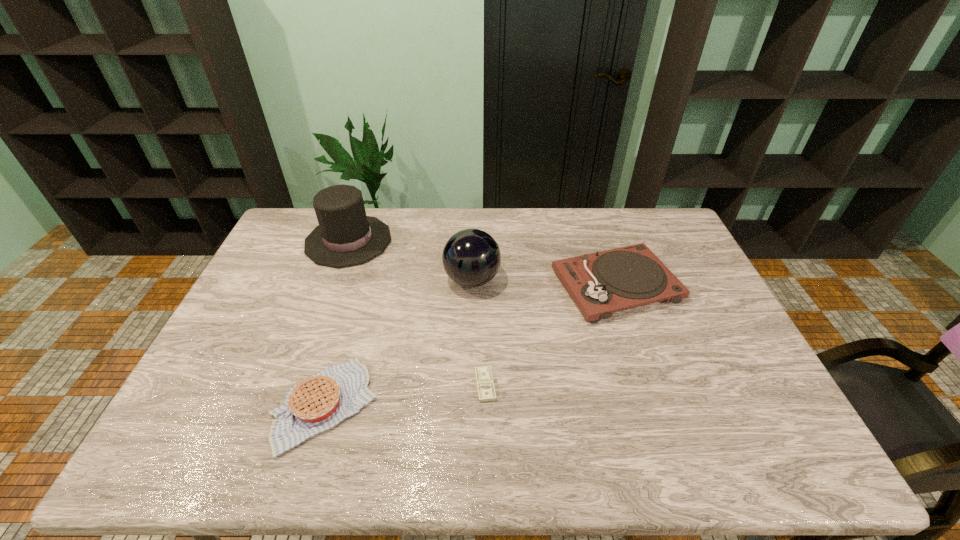
Image resolution: width=960 pixels, height=540 pixels. What are the coordinates of `vacant point that satisfies the following two spatial constraints: 1. on the back side of the phonograph_record; 2. on the front of the dress hat with the decoration` in the screenshot? It's located at (601, 241).

The height and width of the screenshot is (540, 960). In order to click on free spot that satisfies the following two spatial constraints: 1. on the side of the rightmost object with the finger holes; 2. on the left side of the bowling ball in this screenshot , I will do `click(472, 285)`.

What are the coordinates of `free space that satisfies the following two spatial constraints: 1. on the back side of the shortest object; 2. on the right side of the second shortest object` in the screenshot? It's located at (330, 385).